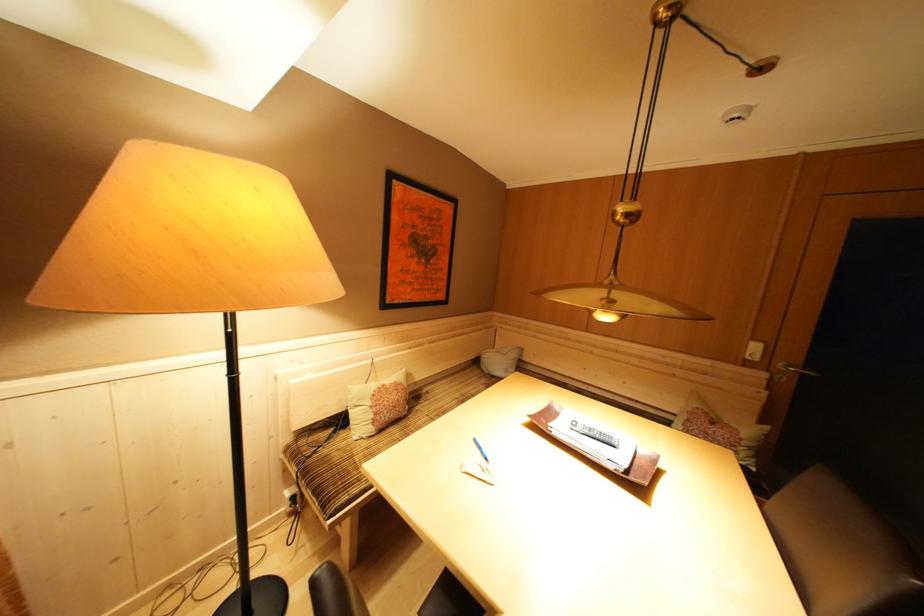
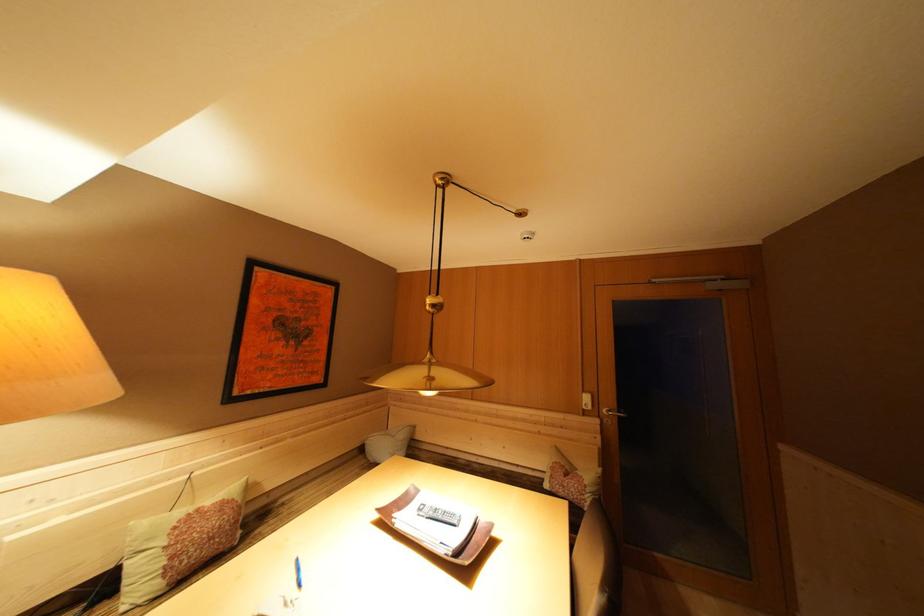
Where in the second image is the point corresponding to (x=618, y=292) from the first image?

(438, 369)